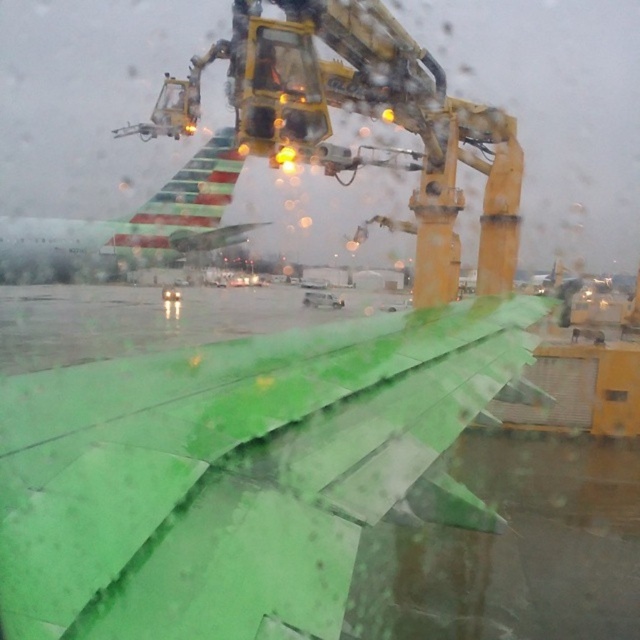
You are a maintenance worker at the airport. You need to inspect both the green matte wing at lower left and the green matte airplane wing at upper left. Which of these two wings is shorter in length?

The green matte wing at lower left is shorter than the green matte airplane wing at upper left.